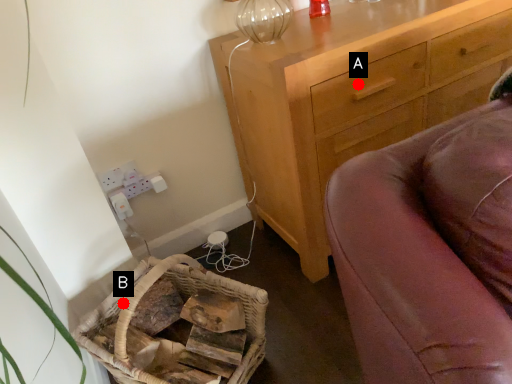
Question: Two points are circled on the image, labeled by A and B beside each circle. Which point is closer to the camera?

Choices:
 (A) A is closer
 (B) B is closer

Answer: (B)